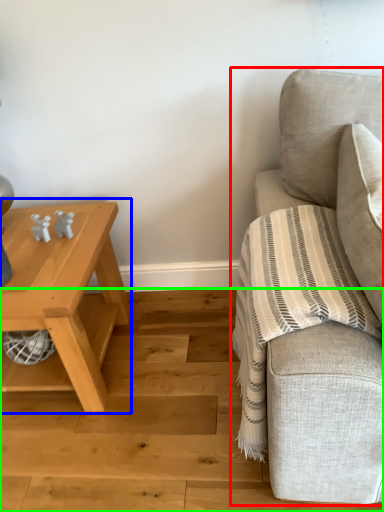
Question: Which object is the farthest from studio couch (highlighted by a red box)? Choose among these: table (highlighted by a blue box) or stair (highlighted by a green box).

Choices:
 (A) table
 (B) stair

Answer: (A)